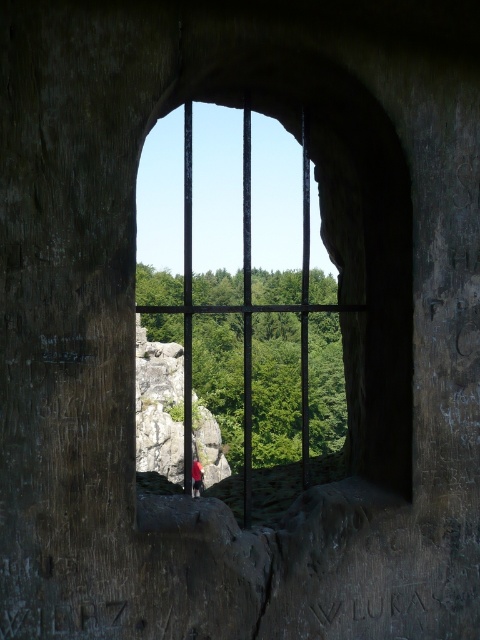
Question: Which point is closer to the camera taking this photo?

Choices:
 (A) (194, 476)
 (B) (304, 486)

Answer: (B)

Question: Among these points, which one is nearest to the camera?

Choices:
 (A) (184, 371)
 (B) (197, 472)

Answer: (A)

Question: Is black metal bars at center bigger than red fabric person at center?

Choices:
 (A) no
 (B) yes

Answer: (B)

Question: Which of the following is the closest to the observer?

Choices:
 (A) black metal bars at center
 (B) red fabric person at center

Answer: (A)

Question: Is black metal bars at center thinner than red fabric person at center?

Choices:
 (A) no
 (B) yes

Answer: (A)

Question: Is black metal bars at center wider than red fabric person at center?

Choices:
 (A) no
 (B) yes

Answer: (B)